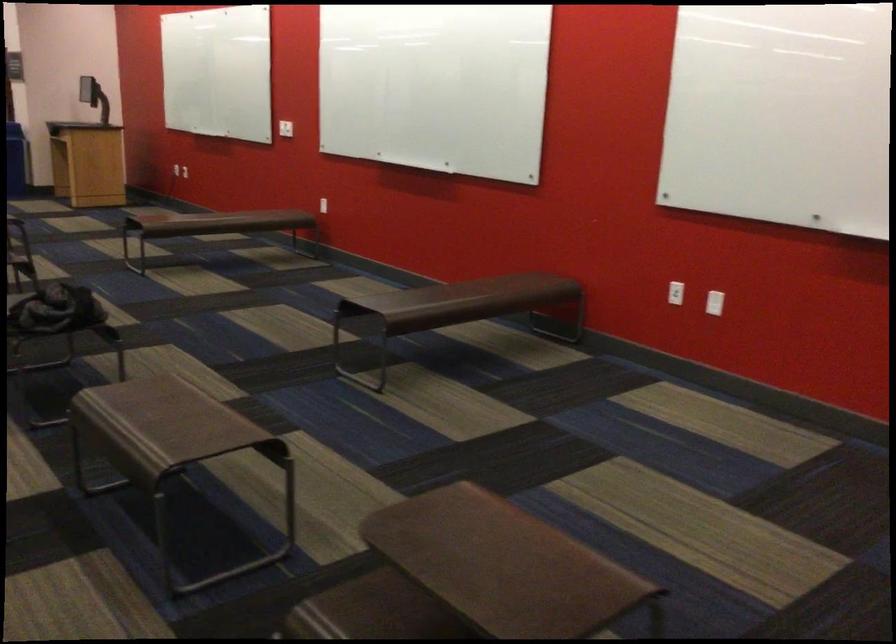
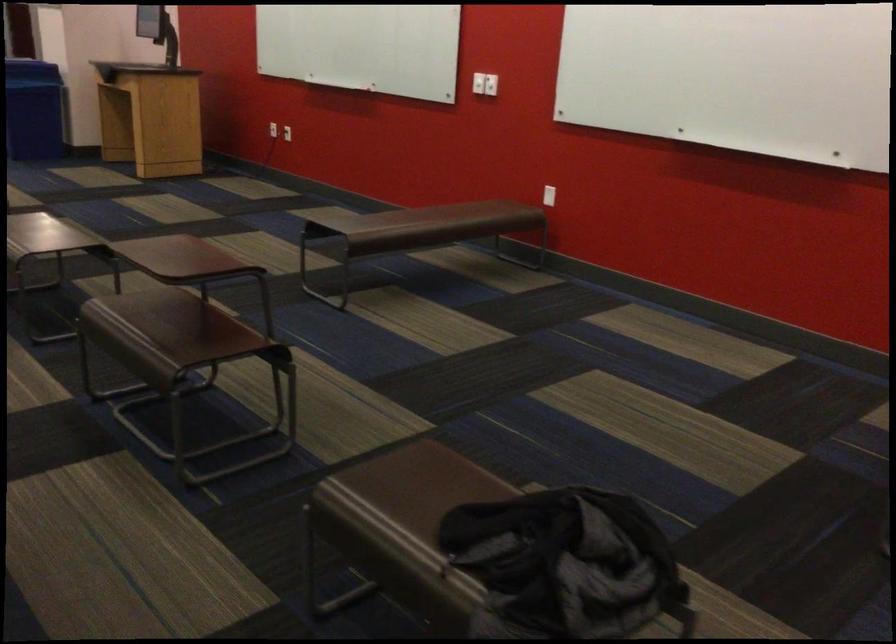
In a continuous first-person perspective shot, in which direction is the camera moving?

The movement direction of the cameraman is left, forward.